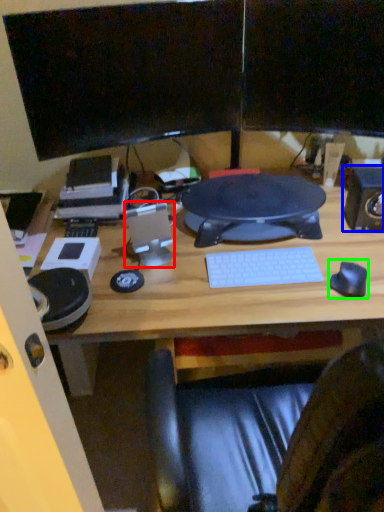
Question: Based on their relative distances, which object is farther from speaker (highlighted by a red box)? Choose from speaker (highlighted by a blue box) and mouse (highlighted by a green box).

Choices:
 (A) speaker
 (B) mouse

Answer: (A)